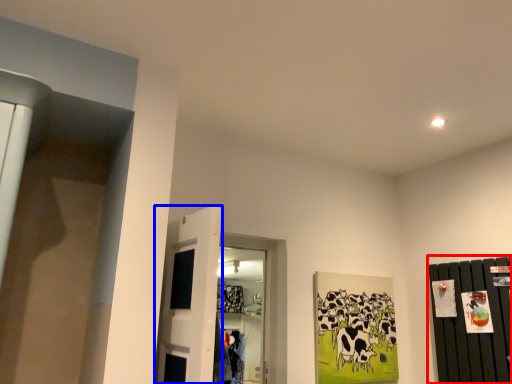
Question: Which point is further to the camera, dresser (highlighted by a red box) or door (highlighted by a blue box)?

Choices:
 (A) dresser
 (B) door

Answer: (A)